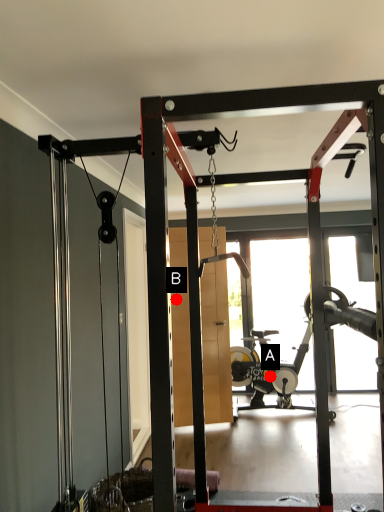
Question: Two points are circled on the image, labeled by A and B beside each circle. Which point is closer to the camera?

Choices:
 (A) A is closer
 (B) B is closer

Answer: (B)